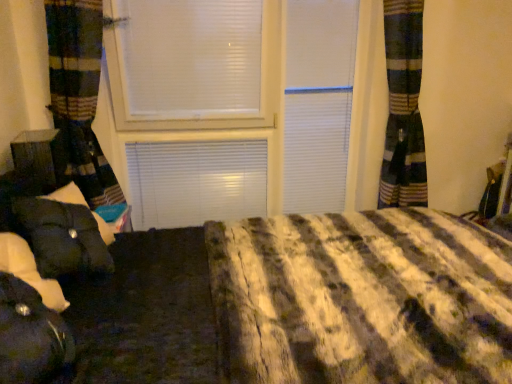
Question: Can you confirm if black fabric bean bag at lower left is positioned to the right of matte black suitcase at left?

Choices:
 (A) no
 (B) yes

Answer: (B)

Question: Is black fabric bean bag at lower left directly adjacent to matte black suitcase at left?

Choices:
 (A) no
 (B) yes

Answer: (A)

Question: From a real-world perspective, is black fabric bean bag at lower left physically below matte black suitcase at left?

Choices:
 (A) no
 (B) yes

Answer: (B)

Question: From the image's perspective, is black fabric bean bag at lower left on top of matte black suitcase at left?

Choices:
 (A) no
 (B) yes

Answer: (A)

Question: Is black fabric bean bag at lower left facing towards matte black suitcase at left?

Choices:
 (A) yes
 (B) no

Answer: (B)

Question: Is black fabric bean bag at lower left outside matte black suitcase at left?

Choices:
 (A) yes
 (B) no

Answer: (A)

Question: Considering the relative sizes of matte black suitcase at left and black fabric bean bag at lower left in the image provided, is matte black suitcase at left shorter than black fabric bean bag at lower left?

Choices:
 (A) no
 (B) yes

Answer: (B)

Question: Is matte black suitcase at left at the left side of black fabric bean bag at lower left?

Choices:
 (A) no
 (B) yes

Answer: (B)

Question: Is there a large distance between matte black suitcase at left and black fabric bean bag at lower left?

Choices:
 (A) no
 (B) yes

Answer: (A)

Question: Is the position of matte black suitcase at left less distant than that of black fabric bean bag at lower left?

Choices:
 (A) no
 (B) yes

Answer: (A)

Question: Is matte black suitcase at left outside of black fabric bean bag at lower left?

Choices:
 (A) no
 (B) yes

Answer: (B)

Question: Can you confirm if matte black suitcase at left is smaller than black fabric bean bag at lower left?

Choices:
 (A) no
 (B) yes

Answer: (B)

Question: Is point (28, 316) closer or farther from the camera than point (47, 145)?

Choices:
 (A) closer
 (B) farther

Answer: (A)